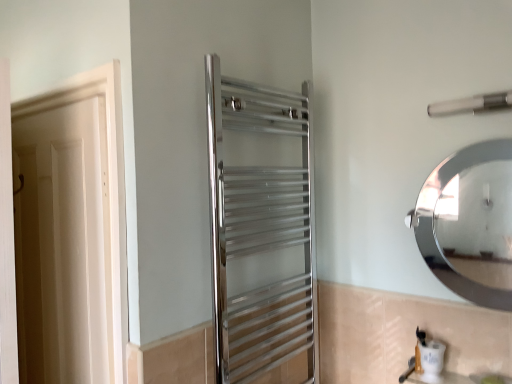
Describe the element at coordinates (7, 239) in the screenshot. This screenshot has width=512, height=384. I see `white wood screen door at left, the second screen door from the right` at that location.

What do you see at coordinates (63, 245) in the screenshot?
I see `white matte door at left` at bounding box center [63, 245].

Where is `satin nickel towel bar at upper right`? satin nickel towel bar at upper right is located at coordinates (472, 104).

What is the approximate height of polished chrome towel rack at center, placed as the 1th screen door when sorted from right to left?

It is 3.62 feet.

This screenshot has height=384, width=512. I want to click on white wood screen door at left, the second screen door from the right, so tap(7, 239).

Is white matte door at left at the right side of polished chrome towel rack at center, placed as the 1th screen door when sorted from right to left?

No, white matte door at left is not to the right of polished chrome towel rack at center, placed as the 1th screen door when sorted from right to left.

From the image's perspective, does white matte door at left appear lower than polished chrome towel rack at center, placed as the 1th screen door when sorted from right to left?

Yes, from the image's perspective, white matte door at left is below polished chrome towel rack at center, placed as the 1th screen door when sorted from right to left.

Is point (55, 157) in front of point (222, 283)?

No, it is behind (222, 283).

Can you confirm if white wood screen door at left, arranged as the 1th screen door when viewed from the left, is thinner than white matte door at left?

Incorrect, the width of white wood screen door at left, arranged as the 1th screen door when viewed from the left, is not less than that of white matte door at left.

From a real-world perspective, is white wood screen door at left, arranged as the 1th screen door when viewed from the left, above or below white matte door at left?

From a real-world perspective, white wood screen door at left, arranged as the 1th screen door when viewed from the left, is physically above white matte door at left.

Between point (7, 227) and point (69, 236), which one is positioned behind?

The point (69, 236) is farther from the camera.

The height and width of the screenshot is (384, 512). In order to click on screen door that is the 1st one above the white matte door at left (from a real-world perspective) in this screenshot , I will do `click(7, 239)`.

Is white wood screen door at left, the second screen door from the right, in front of or behind satin nickel towel bar at upper right in the image?

white wood screen door at left, the second screen door from the right, is in front of satin nickel towel bar at upper right.

Does white wood screen door at left, arranged as the 1th screen door when viewed from the left, have a smaller size compared to satin nickel towel bar at upper right?

No.

From a real-world perspective, is white wood screen door at left, the second screen door from the right, located beneath satin nickel towel bar at upper right?

Yes, from a real-world perspective, white wood screen door at left, the second screen door from the right, is beneath satin nickel towel bar at upper right.

Does white wood screen door at left, the second screen door from the right, have a greater height compared to satin nickel towel bar at upper right?

Yes, white wood screen door at left, the second screen door from the right, is taller than satin nickel towel bar at upper right.

Considering the relative positions of white matte door at left and white wood screen door at left, the second screen door from the right, in the image provided, is white matte door at left to the right of white wood screen door at left, the second screen door from the right, from the viewer's perspective?

Yes.

Is there a large distance between white matte door at left and white wood screen door at left, arranged as the 1th screen door when viewed from the left?

No.

Looking at the image, does white matte door at left seem bigger or smaller compared to white wood screen door at left, the second screen door from the right?

In the image, white matte door at left appears to be smaller than white wood screen door at left, the second screen door from the right.

Based on their sizes in the image, would you say satin nickel towel bar at upper right is bigger or smaller than white wood screen door at left, the second screen door from the right?

Clearly, satin nickel towel bar at upper right is smaller in size than white wood screen door at left, the second screen door from the right.

Is the position of satin nickel towel bar at upper right less distant than that of white wood screen door at left, arranged as the 1th screen door when viewed from the left?

No, the depth of satin nickel towel bar at upper right is greater than that of white wood screen door at left, arranged as the 1th screen door when viewed from the left.

Is satin nickel towel bar at upper right to the right of white wood screen door at left, arranged as the 1th screen door when viewed from the left, from the viewer's perspective?

Yes, satin nickel towel bar at upper right is to the right of white wood screen door at left, arranged as the 1th screen door when viewed from the left.

Considering the sizes of objects satin nickel towel bar at upper right and white wood screen door at left, the second screen door from the right, in the image provided, who is wider, satin nickel towel bar at upper right or white wood screen door at left, the second screen door from the right,?

With larger width is satin nickel towel bar at upper right.

Consider the image. Is white matte door at left oriented away from satin nickel towel bar at upper right?

white matte door at left is not turned away from satin nickel towel bar at upper right.

From the image's perspective, which is below, white matte door at left or satin nickel towel bar at upper right?

From the image's view, white matte door at left is below.

Considering the sizes of objects white matte door at left and satin nickel towel bar at upper right in the image provided, who is thinner, white matte door at left or satin nickel towel bar at upper right?

With smaller width is white matte door at left.

Does satin nickel towel bar at upper right have a lesser height compared to polished chrome towel rack at center, placed as the 1th screen door when sorted from right to left?

Correct, satin nickel towel bar at upper right is not as tall as polished chrome towel rack at center, placed as the 1th screen door when sorted from right to left.

Which object is thinner, satin nickel towel bar at upper right or polished chrome towel rack at center, placed as the 1th screen door when sorted from right to left?

satin nickel towel bar at upper right.

From a real-world perspective, is satin nickel towel bar at upper right physically located above or below polished chrome towel rack at center, the second screen door positioned from the left?

From a real-world perspective, satin nickel towel bar at upper right is physically above polished chrome towel rack at center, the second screen door positioned from the left.

Are satin nickel towel bar at upper right and polished chrome towel rack at center, the second screen door positioned from the left, far apart?

They are positioned close to each other.

Where is `the 2nd screen door above the white matte door at left (from the image's perspective)`? The image size is (512, 384). the 2nd screen door above the white matte door at left (from the image's perspective) is located at coordinates (261, 231).

The image size is (512, 384). I want to click on screen door to the left of white matte door at left, so click(7, 239).

Which object lies nearer to the anchor point white wood screen door at left, the second screen door from the right, white matte door at left or polished chrome towel rack at center, the second screen door positioned from the left?

white matte door at left lies closer to white wood screen door at left, the second screen door from the right, than the other object.

Consider the image. Based on their spatial positions, is white wood screen door at left, arranged as the 1th screen door when viewed from the left, or white matte door at left further from satin nickel towel bar at upper right?

The object further to satin nickel towel bar at upper right is white wood screen door at left, arranged as the 1th screen door when viewed from the left.

From the image, which object appears to be nearer to white matte door at left, white wood screen door at left, arranged as the 1th screen door when viewed from the left, or satin nickel towel bar at upper right?

white wood screen door at left, arranged as the 1th screen door when viewed from the left, is closer to white matte door at left.

Considering their positions, is white wood screen door at left, the second screen door from the right, positioned further to polished chrome towel rack at center, placed as the 1th screen door when sorted from right to left, than satin nickel towel bar at upper right?

white wood screen door at left, the second screen door from the right, is further to polished chrome towel rack at center, placed as the 1th screen door when sorted from right to left.

From the image, which object appears to be farther from polished chrome towel rack at center, placed as the 1th screen door when sorted from right to left, white matte door at left or satin nickel towel bar at upper right?

Among the two, satin nickel towel bar at upper right is located further to polished chrome towel rack at center, placed as the 1th screen door when sorted from right to left.

In the scene shown: From the image, which object appears to be nearer to white wood screen door at left, the second screen door from the right, white matte door at left or satin nickel towel bar at upper right?

Among the two, white matte door at left is located nearer to white wood screen door at left, the second screen door from the right.

Estimate the real-world distances between objects in this image. Which object is closer to white matte door at left, white wood screen door at left, the second screen door from the right, or polished chrome towel rack at center, the second screen door positioned from the left?

white wood screen door at left, the second screen door from the right.

Estimate the real-world distances between objects in this image. Which object is closer to white matte door at left, satin nickel towel bar at upper right or white wood screen door at left, the second screen door from the right?

white wood screen door at left, the second screen door from the right, lies closer to white matte door at left than the other object.

Image resolution: width=512 pixels, height=384 pixels. Find the location of `door between white wood screen door at left, arranged as the 1th screen door when viewed from the left, and satin nickel towel bar at upper right from left to right`. door between white wood screen door at left, arranged as the 1th screen door when viewed from the left, and satin nickel towel bar at upper right from left to right is located at coordinates (63, 245).

At what (x,y) coordinates should I click in order to perform the action: click on screen door located between white wood screen door at left, arranged as the 1th screen door when viewed from the left, and satin nickel towel bar at upper right in the left-right direction. Please return your answer as a coordinate pair (x, y). Looking at the image, I should click on (261, 231).

At what (x,y) coordinates should I click in order to perform the action: click on door located between white wood screen door at left, the second screen door from the right, and polished chrome towel rack at center, the second screen door positioned from the left, in the left-right direction. Please return your answer as a coordinate pair (x, y). This screenshot has width=512, height=384. Looking at the image, I should click on (63, 245).

At what (x,y) coordinates should I click in order to perform the action: click on screen door between white matte door at left and satin nickel towel bar at upper right from left to right. Please return your answer as a coordinate pair (x, y). Looking at the image, I should click on (261, 231).